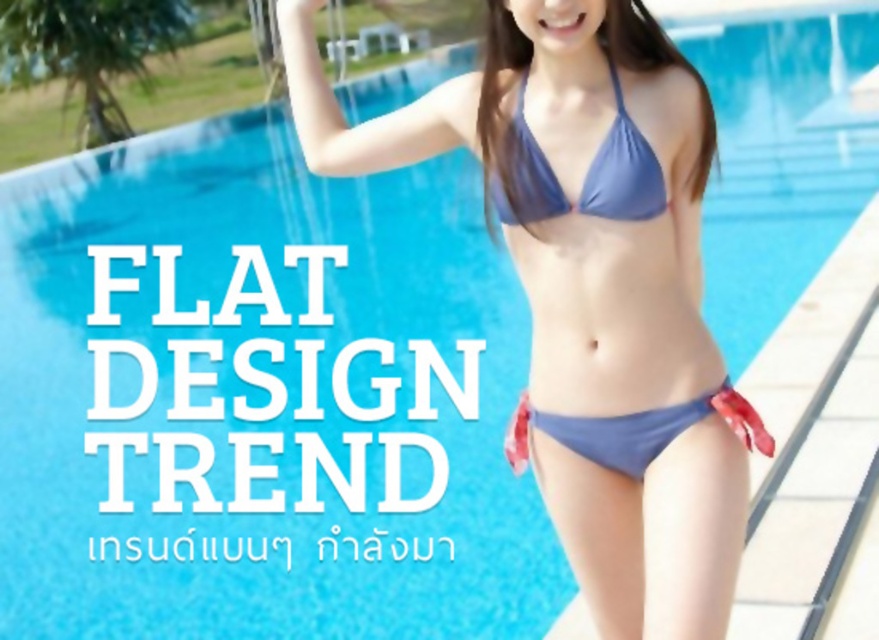
You are designing a poster and need to arrange two bikinis from the image. The blue fabric bikini at upper right and the matte blue bikini top at center. According to the image, which one should be placed closer to the viewer in the poster to maintain the original spatial relationship?

The blue fabric bikini at upper right should be placed closer to the viewer in the poster since it is in front of the matte blue bikini top at center in the original image.

You are designing a poster and need to place two blue fabric bikinis from the scene. The bikinis are labeled as blue fabric bikini at upper right and blue fabric bikini at center. Which bikini should you choose if you want the one that appears larger in height?

The blue fabric bikini at upper right is taller than the blue fabric bikini at center, so you should choose the blue fabric bikini at upper right if you want the one that appears larger in height.

You are a photographer adjusting your camera to focus on two points in the image. The first point is point (554,348) and the second point is point (513,221). Which point is closer to your camera lens?

Point (554,348) is further to the viewer than point (513,221), so the second point is closer to the camera lens.